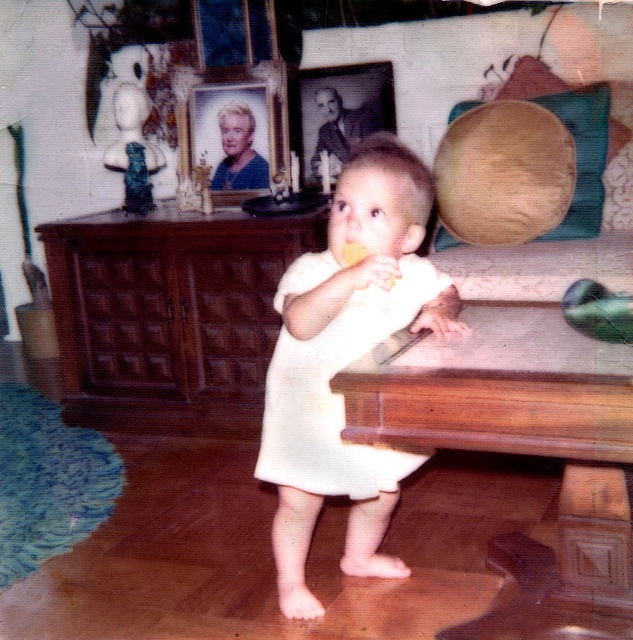
Is wooden table at center to the right of yellow matte food at center from the viewer's perspective?

Indeed, wooden table at center is positioned on the right side of yellow matte food at center.

Does wooden table at center have a smaller size compared to yellow matte food at center?

Incorrect, wooden table at center is not smaller in size than yellow matte food at center.

Is point (489, 342) farther from viewer compared to point (353, 243)?

Yes, point (489, 342) is farther from viewer.

Image resolution: width=633 pixels, height=640 pixels. In order to click on wooden table at center in this screenshot , I will do `click(522, 452)`.

In the scene shown: Does wooden table at center have a greater width compared to white cotton dress at center?

Correct, the width of wooden table at center exceeds that of white cotton dress at center.

Does wooden table at center have a larger size compared to white cotton dress at center?

No.

Is point (468, 472) farther from camera compared to point (303, 349)?

Yes.

Find the location of `wooden table at center`. wooden table at center is located at coordinates (522, 452).

Can you confirm if white matte dress at center is taller than wooden picture frame at upper center?

No.

From the picture: Between white matte dress at center and wooden picture frame at upper center, which one appears on the right side from the viewer's perspective?

From the viewer's perspective, white matte dress at center appears more on the right side.

Which is in front, point (415, 284) or point (218, 138)?

Positioned in front is point (415, 284).

At what (x,y) coordinates should I click in order to perform the action: click on white matte dress at center. Please return your answer as a coordinate pair (x, y). This screenshot has width=633, height=640. Looking at the image, I should click on (337, 394).